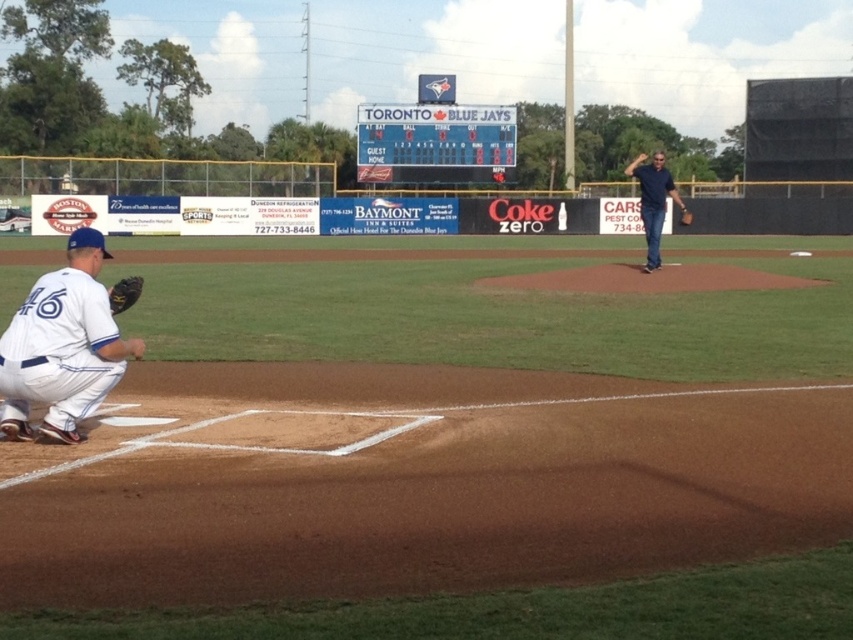
Looking at this image, between dark brown leather glove at lower left and brown leather glove at center, which one appears on the right side from the viewer's perspective?

brown leather glove at center is more to the right.

Is point (135, 276) behind point (685, 211)?

No, it is not.

Which is behind, point (114, 288) or point (688, 212)?

Point (688, 212)

At what (x,y) coordinates should I click in order to perform the action: click on dark brown leather glove at lower left. Please return your answer as a coordinate pair (x, y). Looking at the image, I should click on (125, 292).

Is white uniform at lower left above blue jeans at center?

No, white uniform at lower left is not above blue jeans at center.

Between point (33, 337) and point (648, 189), which one is positioned behind?

Point (648, 189)

Locate an element on the screen. The image size is (853, 640). white uniform at lower left is located at coordinates (62, 346).

Which is behind, point (28, 305) or point (112, 291)?

Positioned behind is point (112, 291).

Is white uniform at lower left shorter than dark brown leather glove at lower left?

Incorrect, white uniform at lower left's height does not fall short of dark brown leather glove at lower left's.

The width and height of the screenshot is (853, 640). What do you see at coordinates (62, 346) in the screenshot? I see `white uniform at lower left` at bounding box center [62, 346].

Where is `white uniform at lower left`? The width and height of the screenshot is (853, 640). white uniform at lower left is located at coordinates (62, 346).